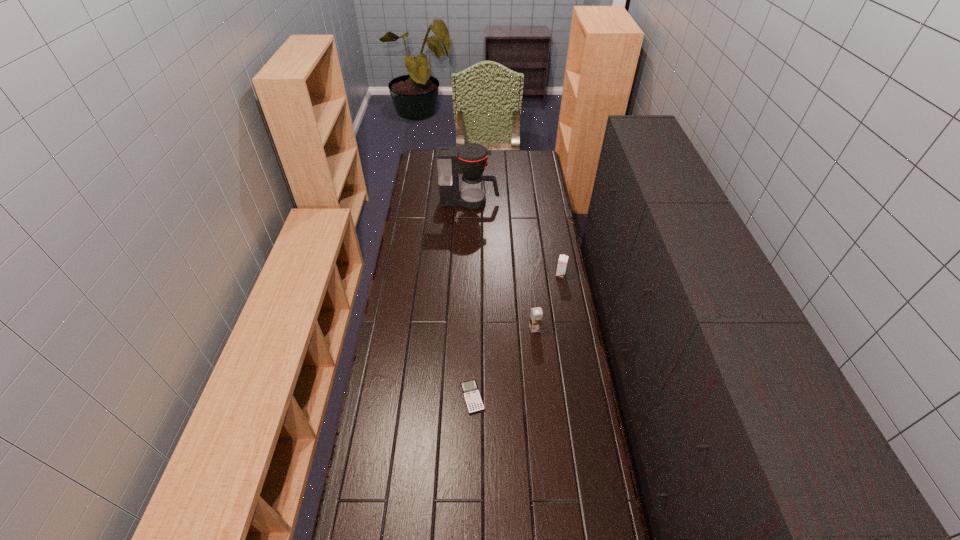
Image resolution: width=960 pixels, height=540 pixels. I want to click on vacant area that lies between the farthest object and the nearer chocolate milk, so click(502, 265).

Identify the location of unoccupied area between the farthest object and the rightmost object. The image size is (960, 540). point(516,239).

I want to click on free spot between the farther chocolate milk and the coffee maker, so click(x=516, y=239).

The height and width of the screenshot is (540, 960). I want to click on free spot between the shortest object and the left chocolate milk, so click(503, 363).

Find the location of a particular element. This screenshot has height=540, width=960. empty space that is in between the rightmost object and the shortest object is located at coordinates (516, 336).

Find the location of `object identified as the third closest to the calculator`. object identified as the third closest to the calculator is located at coordinates (470, 159).

Identify the location of object that is the closest to the right chocolate milk. Image resolution: width=960 pixels, height=540 pixels. (536, 314).

Locate an element on the screen. The image size is (960, 540). vacant position in the image that satisfies the following two spatial constraints: 1. pour from the carafe of the nearest object; 2. on the left side of the coffee maker is located at coordinates (465, 397).

You are a GUI agent. You are given a task and a screenshot of the screen. Output one action in this format:
    pyautogui.click(x=<x>, y=<y>)
    Task: Click on the free space that satisfies the following two spatial constraints: 1. on the back side of the third farthest object; 2. pour from the carafe of the coffee maker
    
    Given the screenshot: What is the action you would take?
    pyautogui.click(x=521, y=202)

Locate an element on the screen. This screenshot has width=960, height=540. free space in the image that satisfies the following two spatial constraints: 1. pour from the carafe of the shortest object; 2. on the left side of the tallest object is located at coordinates (465, 397).